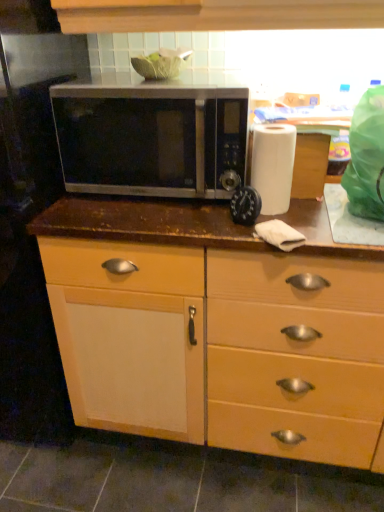
The image size is (384, 512). I want to click on satin silver microwave at center, so click(151, 139).

The width and height of the screenshot is (384, 512). Identify the location of white matte paper towel at right. (273, 165).

What do you see at coordinates (233, 324) in the screenshot? I see `matte wood cabinet at center` at bounding box center [233, 324].

Locate an element on the screen. This screenshot has width=384, height=512. satin silver microwave at center is located at coordinates (151, 139).

Who is smaller, black plastic timer at center or satin silver microwave at center?

black plastic timer at center is smaller.

From a real-world perspective, who is located lower, black plastic timer at center or satin silver microwave at center?

black plastic timer at center is physically lower.

Which point is more forward, (255,192) or (211,87)?

Positioned in front is point (255,192).

How different are the orientations of black plastic timer at center and satin silver microwave at center in degrees?

2.15 degrees separate the facing orientations of black plastic timer at center and satin silver microwave at center.

Looking at this image, is white matte paper towel at right looking in the opposite direction of matte wood cabinet at center?

No, matte wood cabinet at center is not at the back of white matte paper towel at right.

Does white matte paper towel at right have a lesser width compared to matte wood cabinet at center?

Indeed, white matte paper towel at right has a lesser width compared to matte wood cabinet at center.

Which object is positioned more to the left, white matte paper towel at right or matte wood cabinet at center?

matte wood cabinet at center is more to the left.

Is white matte paper towel at right directly adjacent to matte wood cabinet at center?

No, white matte paper towel at right is not next to matte wood cabinet at center.

Consider the image. Considering the sizes of objects white matte paper towel at right and satin silver microwave at center in the image provided, who is taller, white matte paper towel at right or satin silver microwave at center?

With more height is satin silver microwave at center.

Is white matte paper towel at right outside of satin silver microwave at center?

Yes.

You are a GUI agent. You are given a task and a screenshot of the screen. Output one action in this format:
    pyautogui.click(x=<x>, y=<y>)
    Task: Click on the paper towel below the satin silver microwave at center (from the image's perspective)
    This screenshot has height=512, width=384.
    Given the screenshot: What is the action you would take?
    pyautogui.click(x=273, y=165)

Which object is further away from the camera taking this photo, white matte paper towel at right or satin silver microwave at center?

white matte paper towel at right is further from the camera.

From their relative heights in the image, would you say satin silver microwave at center is taller or shorter than black plastic timer at center?

satin silver microwave at center is taller than black plastic timer at center.

Based on the photo, is satin silver microwave at center not close to black plastic timer at center?

satin silver microwave at center is near black plastic timer at center, not far away.

Between satin silver microwave at center and black plastic timer at center, which one appears on the right side from the viewer's perspective?

black plastic timer at center.

Where is `appliance behind the satin silver microwave at center`? This screenshot has width=384, height=512. appliance behind the satin silver microwave at center is located at coordinates (245, 206).

Does matte wood cabinet at center have a smaller size compared to black plastic timer at center?

No.

Is matte wood cabinet at center in front of or behind black plastic timer at center in the image?

Clearly, matte wood cabinet at center is in front of black plastic timer at center.

Considering the sizes of objects matte wood cabinet at center and black plastic timer at center in the image provided, who is shorter, matte wood cabinet at center or black plastic timer at center?

black plastic timer at center.

You are a GUI agent. You are given a task and a screenshot of the screen. Output one action in this format:
    pyautogui.click(x=<x>, y=<y>)
    Task: Click on the cabinetry lying below the black plastic timer at center (from the image's perspective)
    The image size is (384, 512).
    Given the screenshot: What is the action you would take?
    coord(233,324)

Is matte wood cabinet at center wider than white matte paper towel at right?

Indeed, matte wood cabinet at center has a greater width compared to white matte paper towel at right.

Considering the positions of point (271, 391) and point (252, 178), is point (271, 391) closer or farther from the camera than point (252, 178)?

Clearly, point (271, 391) is more distant from the camera than point (252, 178).

How much distance is there between matte wood cabinet at center and white matte paper towel at right?

matte wood cabinet at center is 16.06 inches away from white matte paper towel at right.

Can you see matte wood cabinet at center touching white matte paper towel at right?

There is a gap between matte wood cabinet at center and white matte paper towel at right.

Between satin silver microwave at center and matte wood cabinet at center, which one is positioned behind?

satin silver microwave at center is further from the camera.

Is satin silver microwave at center positioned with its back to matte wood cabinet at center?

No.

Does point (99, 90) appear closer or farther from the camera than point (244, 429)?

Point (99, 90) is positioned closer to the camera compared to point (244, 429).

Find the location of a particular element. The image size is (384, 512). appliance that is behind the satin silver microwave at center is located at coordinates (245, 206).

I want to click on cabinetry that appears on the left of white matte paper towel at right, so click(x=233, y=324).

Based on their spatial positions, is satin silver microwave at center or matte wood cabinet at center further from black plastic timer at center?

The object further to black plastic timer at center is matte wood cabinet at center.

Considering their positions, is white matte paper towel at right positioned closer to satin silver microwave at center than black plastic timer at center?

white matte paper towel at right.

From the image, which object appears to be nearer to matte wood cabinet at center, satin silver microwave at center or black plastic timer at center?

The object closer to matte wood cabinet at center is satin silver microwave at center.

From the picture: When comparing their distances from matte wood cabinet at center, does black plastic timer at center or white matte paper towel at right seem closer?

Based on the image, white matte paper towel at right appears to be nearer to matte wood cabinet at center.

Which object lies nearer to the anchor point white matte paper towel at right, black plastic timer at center or satin silver microwave at center?

black plastic timer at center is positioned closer to the anchor white matte paper towel at right.

From the image, which object appears to be farther from satin silver microwave at center, black plastic timer at center or white matte paper towel at right?

The object further to satin silver microwave at center is black plastic timer at center.

Based on the photo, considering their positions, is satin silver microwave at center positioned closer to white matte paper towel at right than matte wood cabinet at center?

satin silver microwave at center is closer to white matte paper towel at right.

Which object lies nearer to the anchor point satin silver microwave at center, matte wood cabinet at center or black plastic timer at center?

Based on the image, black plastic timer at center appears to be nearer to satin silver microwave at center.

Where is `appliance between white matte paper towel at right and matte wood cabinet at center in the up-down direction`? The height and width of the screenshot is (512, 384). appliance between white matte paper towel at right and matte wood cabinet at center in the up-down direction is located at coordinates (245, 206).

Locate an element on the screen. The height and width of the screenshot is (512, 384). paper towel between satin silver microwave at center and matte wood cabinet at center in the vertical direction is located at coordinates (273, 165).

Identify the location of appliance that lies between satin silver microwave at center and matte wood cabinet at center from top to bottom. (245, 206).

I want to click on appliance between satin silver microwave at center and white matte paper towel at right in the horizontal direction, so click(245, 206).